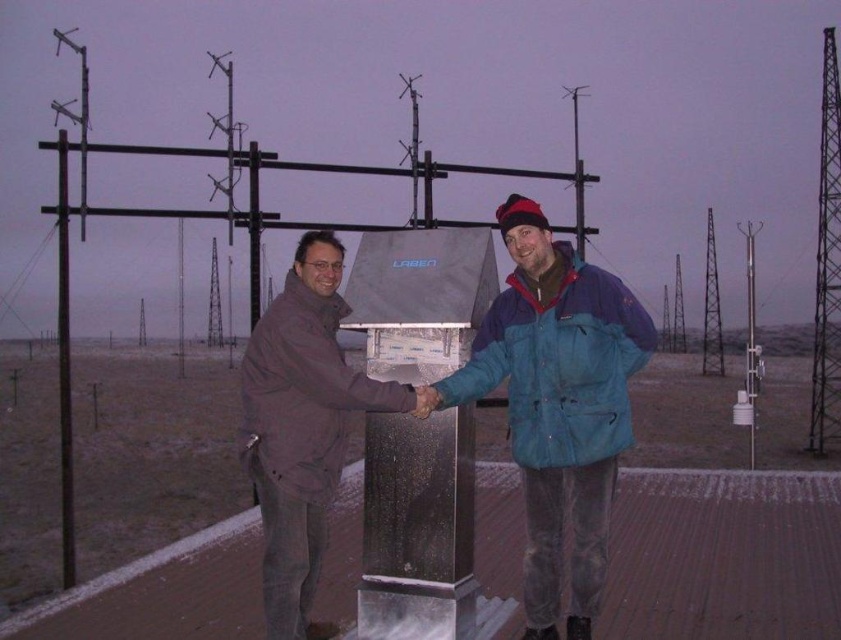
Does blue fabric jacket at center lie in front of smooth black pole at left?

Yes, blue fabric jacket at center is in front of smooth black pole at left.

Does blue fabric jacket at center have a greater width compared to smooth black pole at left?

No.

The height and width of the screenshot is (640, 841). Find the location of `blue fabric jacket at center`. blue fabric jacket at center is located at coordinates (557, 404).

Which is in front, point (311, 486) or point (834, 128)?

Point (311, 486)

Which is behind, point (321, 392) or point (815, 333)?

The point (815, 333) is behind.

This screenshot has height=640, width=841. I want to click on brown matte jacket at center, so click(302, 428).

Is point (527, 412) positioned behind point (832, 40)?

No.

Which is above, blue fabric jacket at center or metallic lattice tower at right?

metallic lattice tower at right is higher up.

Is point (580, 312) in front of point (829, 346)?

Yes, point (580, 312) is in front of point (829, 346).

This screenshot has height=640, width=841. I want to click on blue fabric jacket at center, so click(x=557, y=404).